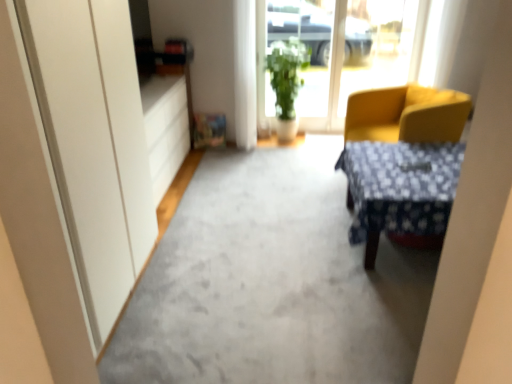
Question: From the image's perspective, relative to yellow fabric chair at right, is matte white drawer at left above or below?

Choices:
 (A) above
 (B) below

Answer: (A)

Question: Relative to yellow fabric chair at right, is matte white drawer at left in front or behind?

Choices:
 (A) front
 (B) behind

Answer: (B)

Question: Estimate the real-world distances between objects in this image. Which object is farther from the green leafy plant at center?

Choices:
 (A) matte white drawer at left
 (B) white glossy screen door at upper center
 (C) transparent glass window at center
 (D) blue fabric desk at center
 (E) gray carpet at center

Answer: (B)

Question: Estimate the real-world distances between objects in this image. Which object is farther from the yellow fabric chair at right?

Choices:
 (A) blue fabric desk at center
 (B) gray carpet at center
 (C) white glossy screen door at upper center
 (D) transparent glass window at center
 (E) green leafy plant at center

Answer: (C)